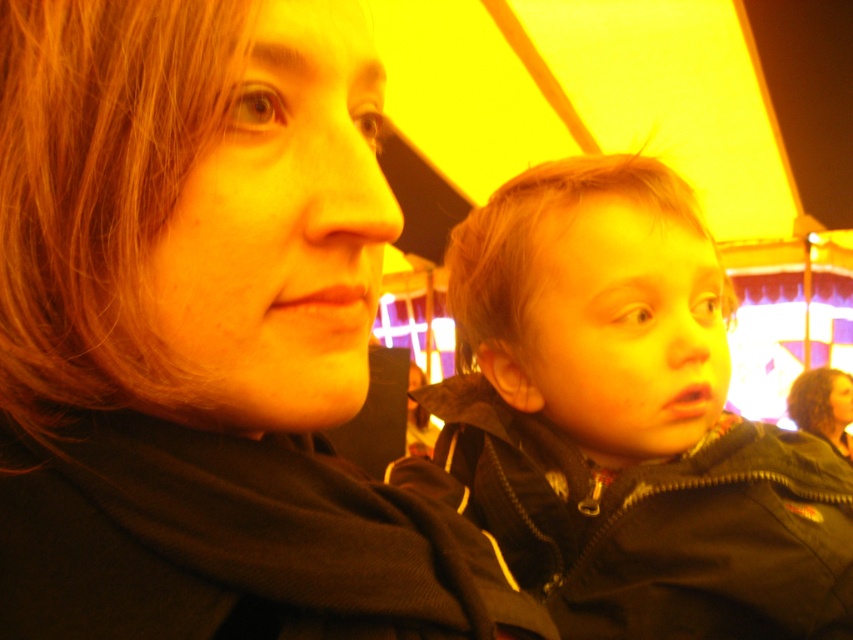
From the picture: You are setting up a small table between the matte black jacket at upper left and the matte black jacket at right. If the table is 20 centimeters wide, will it fit without overlapping either jacket?

The distance between the matte black jacket at upper left and the matte black jacket at right is 22.41 centimeters. Since the table is 20 centimeters wide, there is enough space to fit it between them without overlapping either jacket.